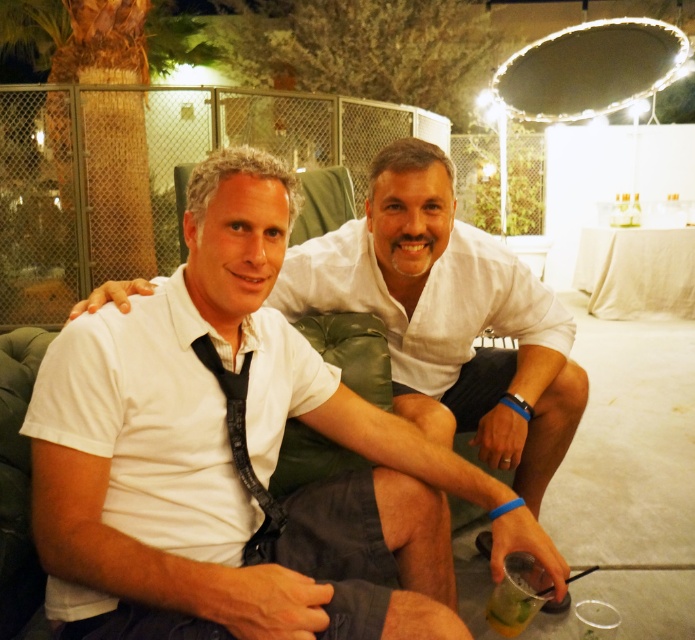
Which is more to the right, white cotton shirt at center or clear plastic cup at lower right?

From the viewer's perspective, clear plastic cup at lower right appears more on the right side.

This screenshot has height=640, width=695. I want to click on white cotton shirt at center, so click(448, 317).